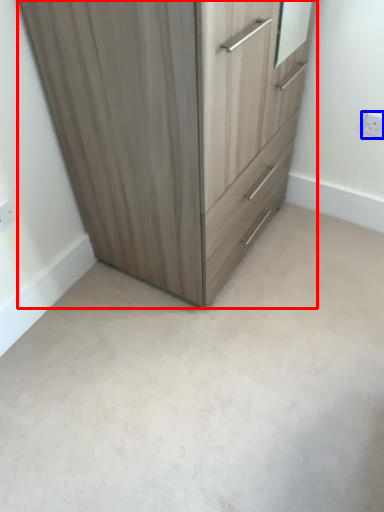
Question: Which point is further to the camera, chest of drawers (highlighted by a red box) or electric outlet (highlighted by a blue box)?

Choices:
 (A) chest of drawers
 (B) electric outlet

Answer: (B)